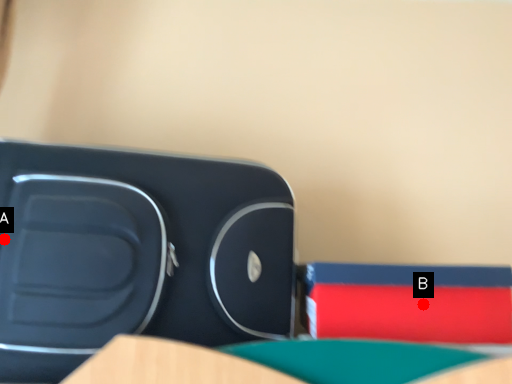
Question: Two points are circled on the image, labeled by A and B beside each circle. Which point is closer to the camera taking this photo?

Choices:
 (A) A is closer
 (B) B is closer

Answer: (A)